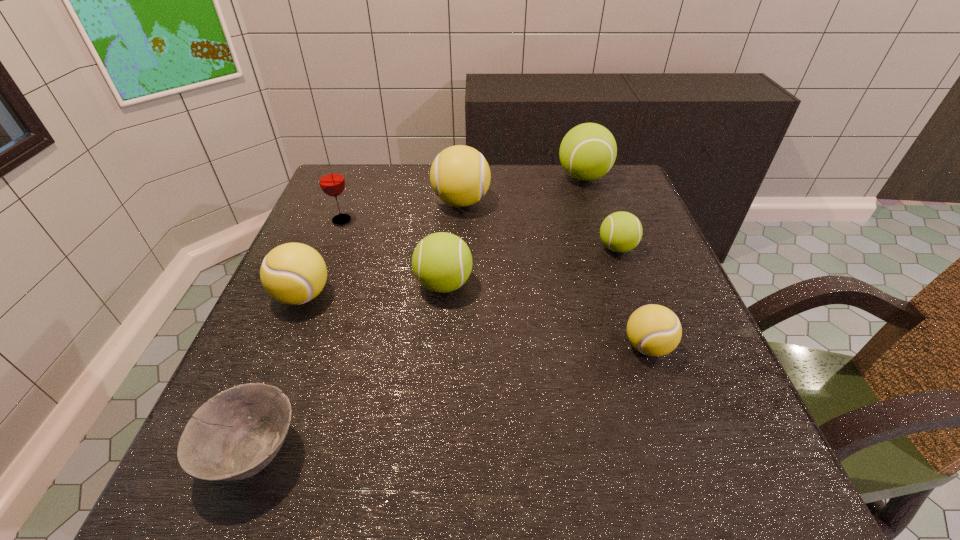
Locate an element on the screen. This screenshot has height=540, width=960. the second nearest green tennis ball is located at coordinates (620, 232).

You are a GUI agent. You are given a task and a screenshot of the screen. Output one action in this format:
    pyautogui.click(x=<x>, y=<y>)
    Task: Click on the fifth nearest object
    Image resolution: width=960 pixels, height=540 pixels.
    Given the screenshot: What is the action you would take?
    pyautogui.click(x=620, y=232)

The height and width of the screenshot is (540, 960). I want to click on the shortest object, so click(x=234, y=435).

The width and height of the screenshot is (960, 540). Find the location of `the nearest object`. the nearest object is located at coordinates point(234,435).

This screenshot has width=960, height=540. What are the coordinates of `vacant space located 0.110m on the front of the farthest green tennis ball` in the screenshot? It's located at (596, 215).

Identify the location of free space located on the front of the farthest yellow tennis ball. This screenshot has width=960, height=540. (456, 294).

I want to click on free region located on the right of the glass, so click(x=471, y=220).

Locate an element on the screen. free location located 0.210m on the right of the leftmost green tennis ball is located at coordinates (574, 284).

Locate an element on the screen. Image resolution: width=960 pixels, height=540 pixels. vacant space located on the back of the second biggest yellow tennis ball is located at coordinates coord(330,227).

In order to click on vacant space located on the left of the smallest yellow tennis ball in this screenshot , I will do `click(578, 347)`.